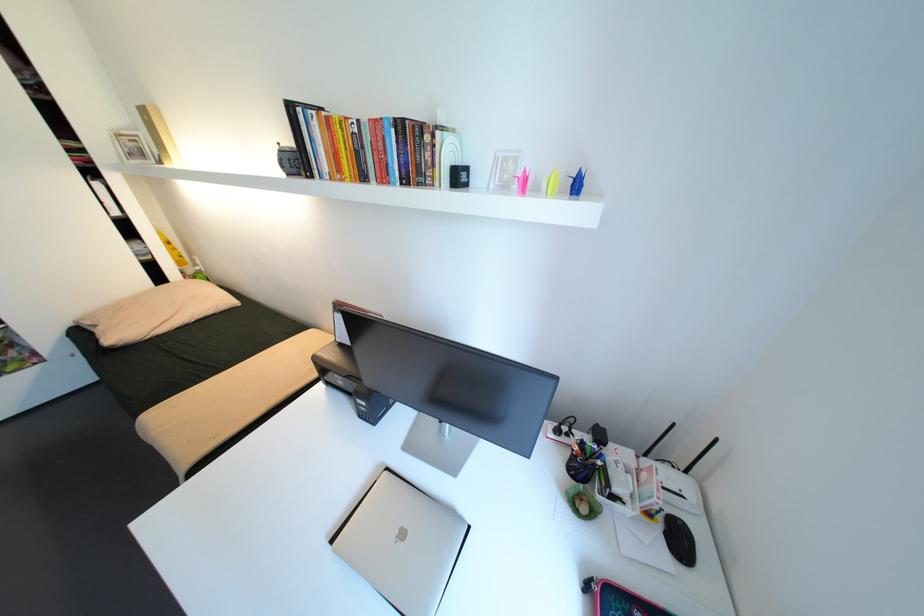
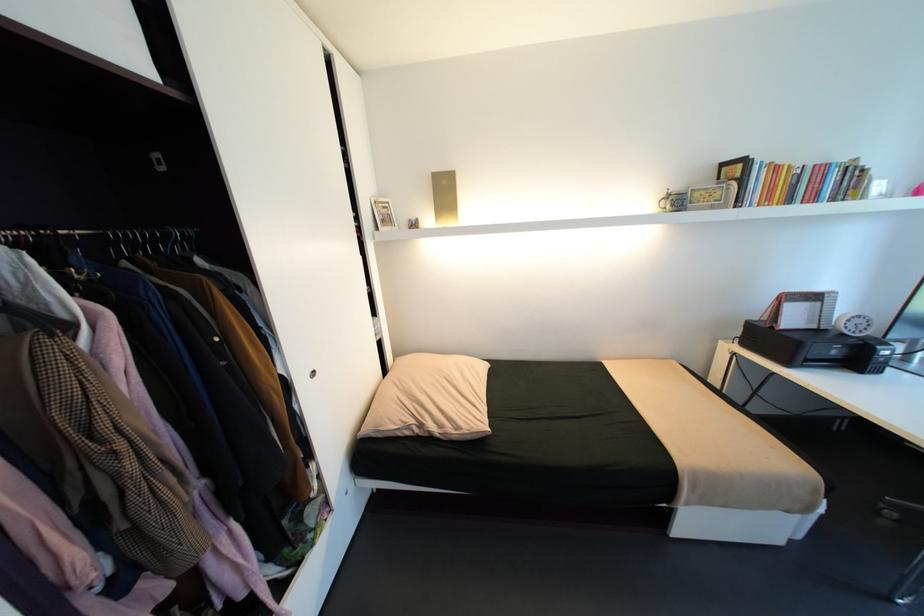
Question: I am providing you with two images of the same scene from different viewpoints. Please identify which objects are invisible in image2.

Choices:
 (A) silver picture frame
 (B) tan pillow
 (C) white analog clock
 (D) none of these

Answer: (D)